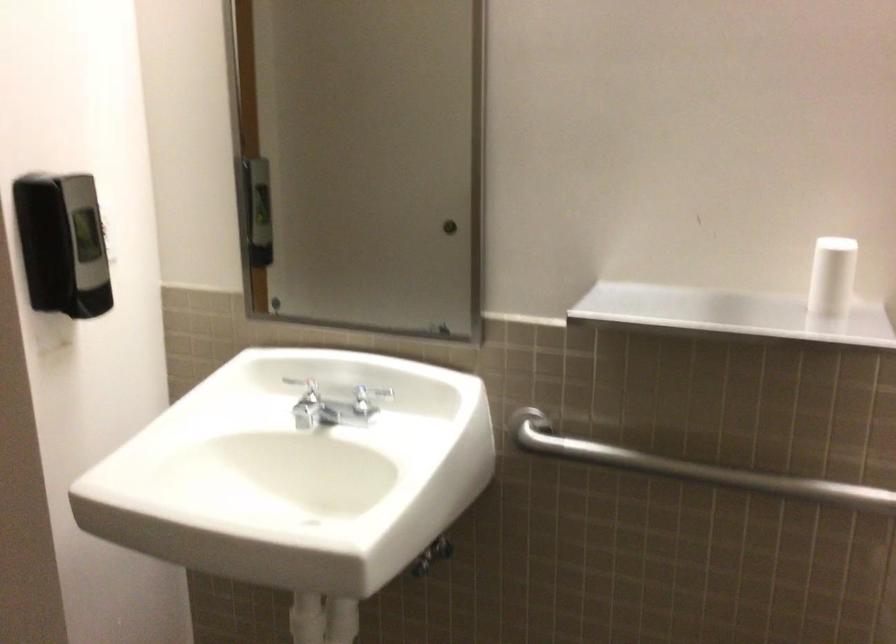
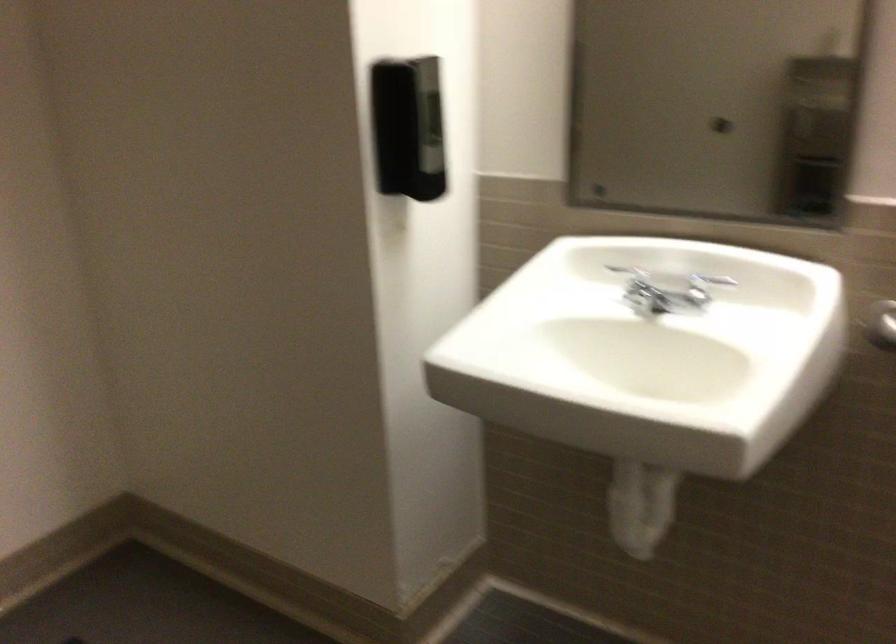
Find the pixel in the second image that matches [373,400] in the first image.

(704, 287)